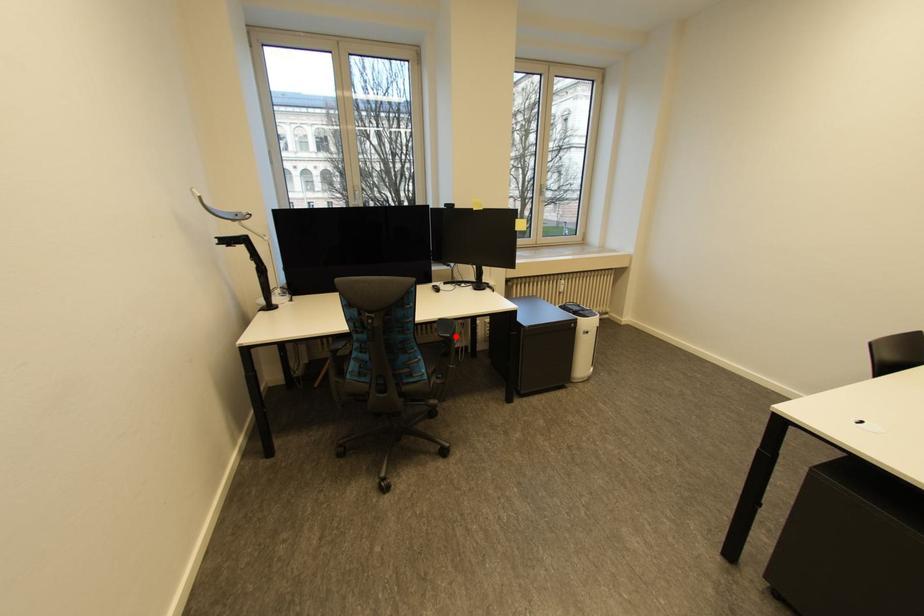
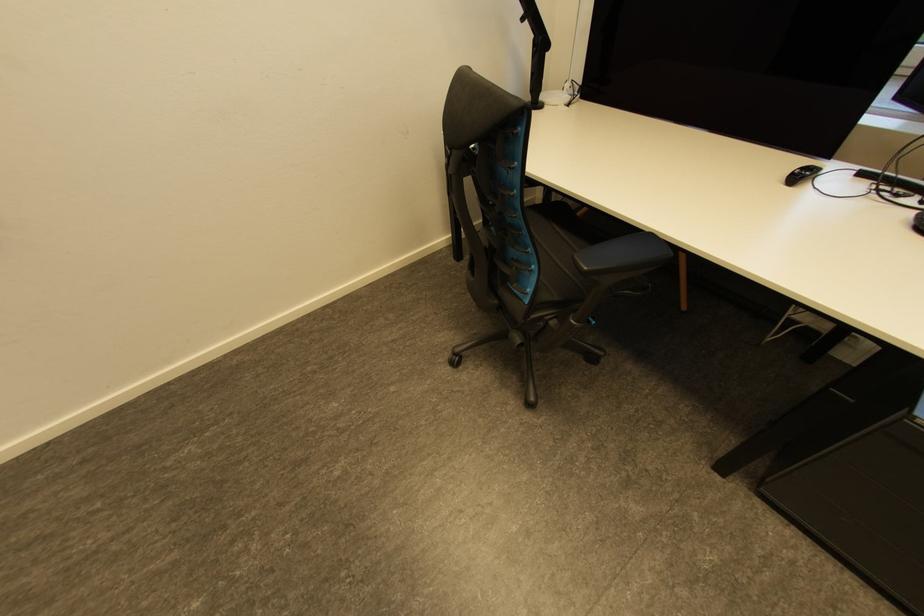
Locate, in the second image, the point that corresponds to the highlighted location in the first image.

(591, 269)